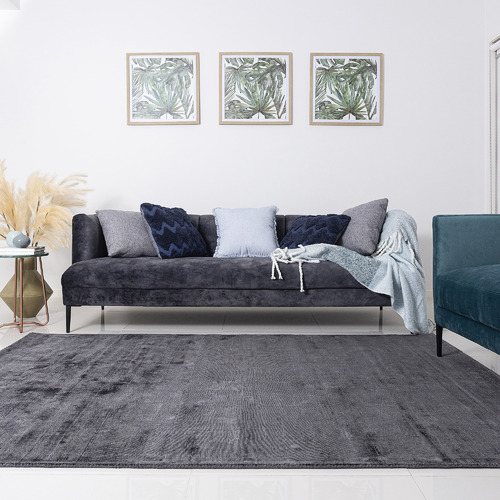
Locate an element on the screen. pictures is located at coordinates (160, 88).